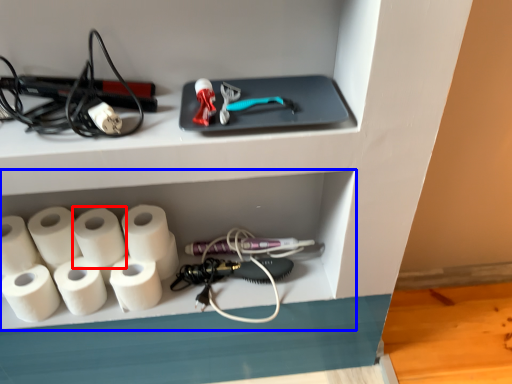
Question: Among these objects, which one is farthest to the camera, paper towel (highlighted by a red box) or shelf (highlighted by a blue box)?

Choices:
 (A) paper towel
 (B) shelf

Answer: (B)